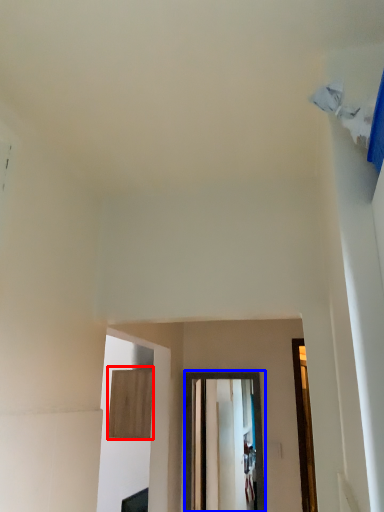
Question: Which object is further to the camera taking this photo, plywood (highlighted by a red box) or glass door (highlighted by a blue box)?

Choices:
 (A) plywood
 (B) glass door

Answer: (A)